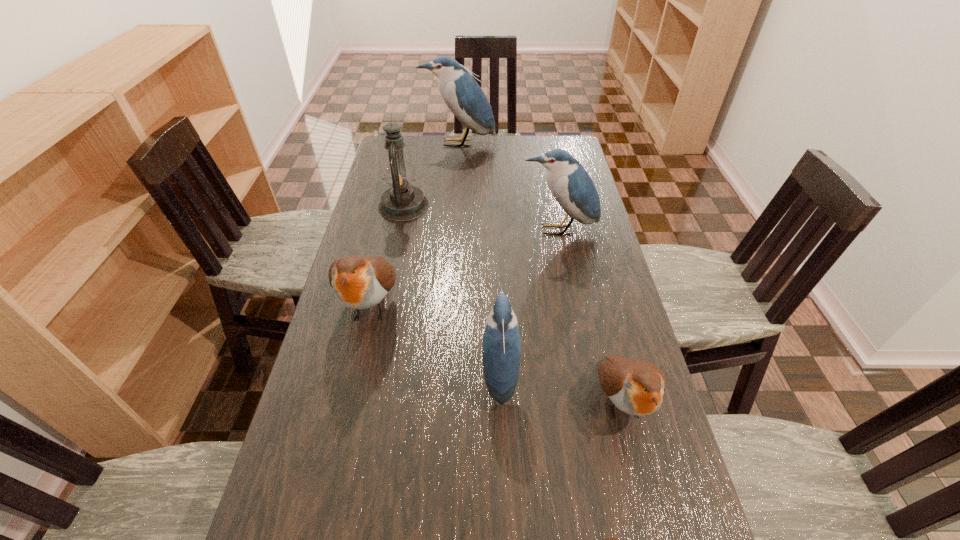
The image size is (960, 540). I want to click on bird that is at the left edge, so click(359, 282).

This screenshot has height=540, width=960. In the image, there is a desktop. Identify the location of vacant space at the far edge. (466, 140).

The width and height of the screenshot is (960, 540). In the image, there is a desktop. Identify the location of vacant space at the left edge. (391, 252).

This screenshot has height=540, width=960. I want to click on vacant space at the right edge of the desktop, so click(560, 224).

This screenshot has height=540, width=960. I want to click on free space at the far left corner of the desktop, so click(x=382, y=156).

The height and width of the screenshot is (540, 960). What are the coordinates of `vacant space at the far right corner of the desktop` in the screenshot? It's located at (558, 145).

Identify the location of free space between the fifth tallest bird and the second nearest blue bird. (589, 315).

At what (x,y) coordinates should I click in order to perform the action: click on empty space between the oil lamp and the smallest blue bird. Please return your answer as a coordinate pair (x, y). The width and height of the screenshot is (960, 540). Looking at the image, I should click on (451, 289).

Where is `vacant area that lies between the second farthest bird and the biggest brown bird`? The height and width of the screenshot is (540, 960). vacant area that lies between the second farthest bird and the biggest brown bird is located at coordinates (465, 268).

Where is `free spot between the farthest brown bird and the smallest blue bird`? The image size is (960, 540). free spot between the farthest brown bird and the smallest blue bird is located at coordinates (436, 340).